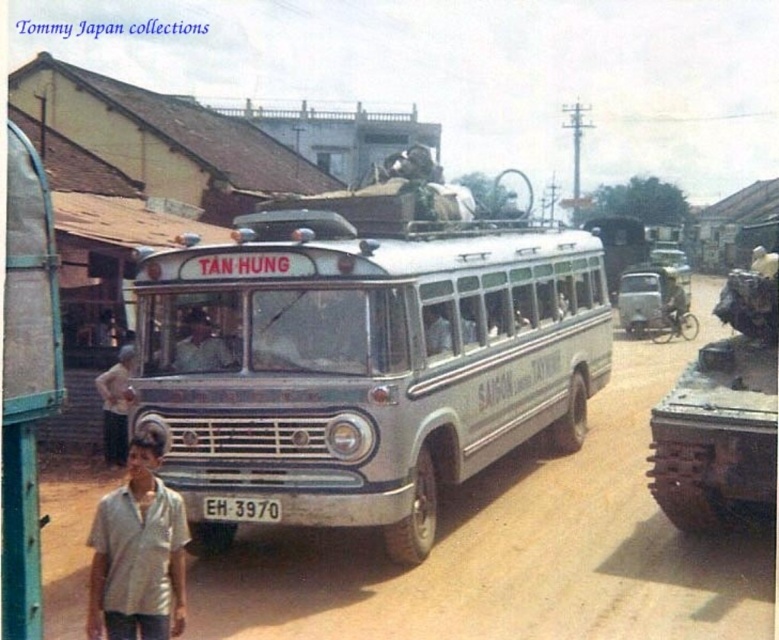
Question: Which point is farther to the camera?

Choices:
 (A) metallic silver helmet at center
 (B) light brown leather jacket at center

Answer: (A)

Question: Among these objects, which one is nearest to the camera?

Choices:
 (A) silver metallic bus at center
 (B) rusty metal tank at right

Answer: (A)

Question: Does light beige shirt at lower left appear on the left side of metallic silver helmet at center?

Choices:
 (A) yes
 (B) no

Answer: (A)

Question: Does rusty metal tank at right come behind light beige shirt at lower left?

Choices:
 (A) yes
 (B) no

Answer: (A)

Question: Where is brown dirt track at center located in relation to metallic silver helmet at center in the image?

Choices:
 (A) above
 (B) below

Answer: (B)

Question: Estimate the real-world distances between objects in this image. Which object is farther from the white plastic license plate at center?

Choices:
 (A) light brown leather jacket at center
 (B) rusty metal tank at right
 (C) silver metallic bus at center
 (D) brown dirt track at center

Answer: (B)